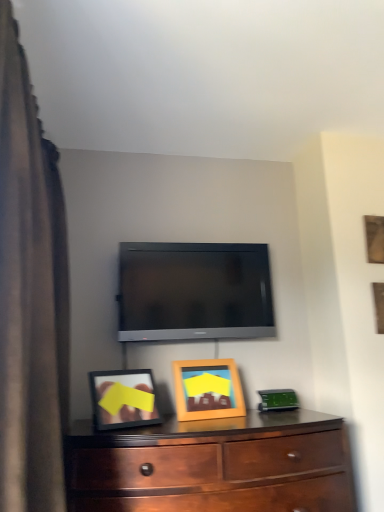
What do you see at coordinates (194, 291) in the screenshot?
I see `matte black tv at center` at bounding box center [194, 291].

This screenshot has width=384, height=512. In order to click on matte black tv at center in this screenshot , I will do `click(194, 291)`.

At what (x,y) coordinates should I click in order to perform the action: click on wooden picture frame at upper right, arranged as the 2th picture frame when viewed from the front. Please return your answer as a coordinate pair (x, y). Looking at the image, I should click on (374, 238).

Locate an element on the screen. The image size is (384, 512). matte black tv at center is located at coordinates (194, 291).

Who is smaller, mahogany wood dresser at lower center or brown fabric curtain at left?

With smaller size is mahogany wood dresser at lower center.

Considering the points (94, 493) and (12, 348), which point is behind, point (94, 493) or point (12, 348)?

Positioned behind is point (94, 493).

Is mahogany wood dresser at lower center far from brown fabric curtain at left?

Actually, mahogany wood dresser at lower center and brown fabric curtain at left are a little close together.

From a real-world perspective, is mahogany wood dresser at lower center physically located above or below brown fabric curtain at left?

mahogany wood dresser at lower center is below brown fabric curtain at left.

Considering the relative sizes of wooden picture frame at center, the first picture frame from the front, and mahogany wood dresser at lower center in the image provided, is wooden picture frame at center, the first picture frame from the front, shorter than mahogany wood dresser at lower center?

Yes, wooden picture frame at center, the first picture frame from the front, is shorter than mahogany wood dresser at lower center.

Is wooden picture frame at center, which ranks as the 1th picture frame in left-to-right order, bigger or smaller than mahogany wood dresser at lower center?

Considering their sizes, wooden picture frame at center, which ranks as the 1th picture frame in left-to-right order, takes up less space than mahogany wood dresser at lower center.

Locate an element on the screen. This screenshot has width=384, height=512. chest of drawers on the left side of wooden picture frame at center, marked as the second picture frame in a back-to-front arrangement is located at coordinates (213, 465).

How different are the orientations of wooden picture frame at center, which ranks as the 1th picture frame in left-to-right order, and mahogany wood dresser at lower center in degrees?

The angle between the facing direction of wooden picture frame at center, which ranks as the 1th picture frame in left-to-right order, and the facing direction of mahogany wood dresser at lower center is 10.5 degrees.

Is brown fabric curtain at left touching mahogany wood dresser at lower center?

brown fabric curtain at left and mahogany wood dresser at lower center are not in contact.

Considering the sizes of brown fabric curtain at left and mahogany wood dresser at lower center in the image, is brown fabric curtain at left bigger or smaller than mahogany wood dresser at lower center?

Considering their sizes, brown fabric curtain at left takes up more space than mahogany wood dresser at lower center.

Between point (64, 287) and point (102, 463), which one is positioned behind?

The point (64, 287) is farther from the camera.

Is point (194, 381) positioned after point (16, 263)?

Yes.

In the scene shown: Based on their positions, is wooden picture frame at center, the first picture frame from the front, located to the left or right of brown fabric curtain at left?

From the image, it's evident that wooden picture frame at center, the first picture frame from the front, is to the right of brown fabric curtain at left.

From a real-world perspective, which object rests below the other?

In real-world perspective, wooden picture frame at center, which appears as the second picture frame when viewed from the right, is lower.

Can you confirm if wooden picture frame at center, the first picture frame from the front, is taller than brown fabric curtain at left?

In fact, wooden picture frame at center, the first picture frame from the front, may be shorter than brown fabric curtain at left.

From the picture: Is mahogany wood dresser at lower center inside or outside of wooden picture frame at center, which is the first picture frame from bottom to top?

mahogany wood dresser at lower center lies outside wooden picture frame at center, which is the first picture frame from bottom to top.

At what (x,y) coordinates should I click in order to perform the action: click on the 1st picture frame to the right of the mahogany wood dresser at lower center, counting from the anchor's position. Please return your answer as a coordinate pair (x, y). The width and height of the screenshot is (384, 512). Looking at the image, I should click on (208, 390).

Based on the photo, who is taller, mahogany wood dresser at lower center or wooden picture frame at center, positioned as the second picture frame in top-to-bottom order?

With more height is mahogany wood dresser at lower center.

Is mahogany wood dresser at lower center not near wooden picture frame at center, positioned as the second picture frame in top-to-bottom order?

No, mahogany wood dresser at lower center is not far from wooden picture frame at center, positioned as the second picture frame in top-to-bottom order.

Which of these two, wooden picture frame at upper right, the first picture frame in the back-to-front sequence, or mahogany wood dresser at lower center, stands taller?

mahogany wood dresser at lower center is taller.

Considering the positions of objects wooden picture frame at upper right, the first picture frame in the back-to-front sequence, and mahogany wood dresser at lower center in the image provided, who is more to the right, wooden picture frame at upper right, the first picture frame in the back-to-front sequence, or mahogany wood dresser at lower center?

wooden picture frame at upper right, the first picture frame in the back-to-front sequence.

Would you say wooden picture frame at upper right, the first picture frame in the back-to-front sequence, is inside or outside mahogany wood dresser at lower center?

wooden picture frame at upper right, the first picture frame in the back-to-front sequence, is located beyond the bounds of mahogany wood dresser at lower center.

From the image's perspective, does wooden picture frame at upper right, positioned as the 1th picture frame in top-to-bottom order, appear lower than mahogany wood dresser at lower center?

No, from the image's perspective, wooden picture frame at upper right, positioned as the 1th picture frame in top-to-bottom order, is not below mahogany wood dresser at lower center.

Which is less distant, (231, 496) or (374, 224)?

Point (231, 496) is closer to the camera than point (374, 224).

Is mahogany wood dresser at lower center positioned with its back to wooden picture frame at upper right, the second picture frame from the bottom?

mahogany wood dresser at lower center does not have its back to wooden picture frame at upper right, the second picture frame from the bottom.

Between mahogany wood dresser at lower center and wooden picture frame at upper right, the second picture frame from the bottom, which one has smaller size?

wooden picture frame at upper right, the second picture frame from the bottom, is smaller.

Image resolution: width=384 pixels, height=512 pixels. I want to click on curtain above the mahogany wood dresser at lower center (from a real-world perspective), so click(x=30, y=294).

At what (x,y) coordinates should I click in order to perform the action: click on the 1st picture frame above when counting from the mahogany wood dresser at lower center (from the image's perspective). Please return your answer as a coordinate pair (x, y). Looking at the image, I should click on (208, 390).

Considering their positions, is wooden picture frame at upper right, acting as the 1th picture frame starting from the right, positioned further to matte black tv at center than wooden picture frame at center, which is the first picture frame from bottom to top?

wooden picture frame at upper right, acting as the 1th picture frame starting from the right, is further to matte black tv at center.

When comparing their distances from wooden picture frame at upper right, the first picture frame in the back-to-front sequence, does matte black tv at center or mahogany wood dresser at lower center seem closer?

matte black tv at center.

From the image, which object appears to be farther from wooden picture frame at center, which appears as the second picture frame when viewed from the right, brown fabric curtain at left or matte black tv at center?

brown fabric curtain at left is positioned further to the anchor wooden picture frame at center, which appears as the second picture frame when viewed from the right.

Based on their spatial positions, is matte black tv at center or wooden picture frame at center, marked as the second picture frame in a back-to-front arrangement, further from wooden picture frame at upper right, acting as the 1th picture frame starting from the right?

wooden picture frame at center, marked as the second picture frame in a back-to-front arrangement, lies further to wooden picture frame at upper right, acting as the 1th picture frame starting from the right, than the other object.

When comparing their distances from mahogany wood dresser at lower center, does brown fabric curtain at left or wooden picture frame at upper right, arranged as the 2th picture frame when viewed from the front, seem closer?

The object closer to mahogany wood dresser at lower center is brown fabric curtain at left.

Based on their spatial positions, is mahogany wood dresser at lower center or wooden picture frame at center, marked as the second picture frame in a back-to-front arrangement, further from matte black tv at center?

mahogany wood dresser at lower center is positioned further to the anchor matte black tv at center.

When comparing their distances from wooden picture frame at upper right, the first picture frame in the back-to-front sequence, does wooden picture frame at center, which appears as the second picture frame when viewed from the right, or mahogany wood dresser at lower center seem closer?

Based on the image, wooden picture frame at center, which appears as the second picture frame when viewed from the right, appears to be nearer to wooden picture frame at upper right, the first picture frame in the back-to-front sequence.

Which object lies nearer to the anchor point brown fabric curtain at left, mahogany wood dresser at lower center or matte black tv at center?

mahogany wood dresser at lower center is positioned closer to the anchor brown fabric curtain at left.

The height and width of the screenshot is (512, 384). Find the location of `picture frame between matte black tv at center and mahogany wood dresser at lower center vertically`. picture frame between matte black tv at center and mahogany wood dresser at lower center vertically is located at coordinates (208, 390).

Where is `chest of drawers between brown fabric curtain at left and wooden picture frame at center, positioned as the second picture frame in top-to-bottom order, along the z-axis`? chest of drawers between brown fabric curtain at left and wooden picture frame at center, positioned as the second picture frame in top-to-bottom order, along the z-axis is located at coordinates (213, 465).

Where is `picture frame positioned between brown fabric curtain at left and matte black tv at center from near to far`? This screenshot has width=384, height=512. picture frame positioned between brown fabric curtain at left and matte black tv at center from near to far is located at coordinates (208, 390).

What are the coordinates of `television between wooden picture frame at upper right, arranged as the 2th picture frame when viewed from the front, and mahogany wood dresser at lower center vertically` in the screenshot? It's located at (194, 291).